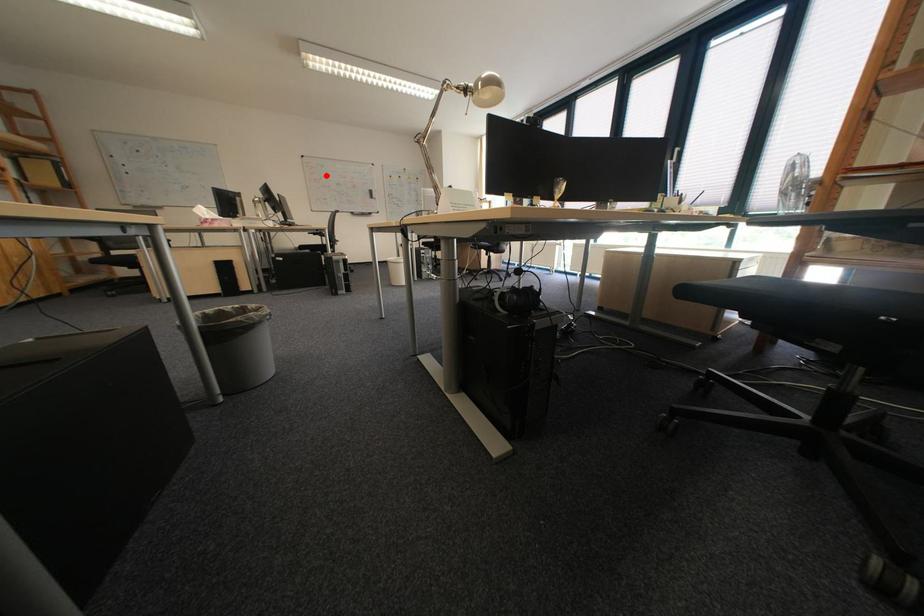
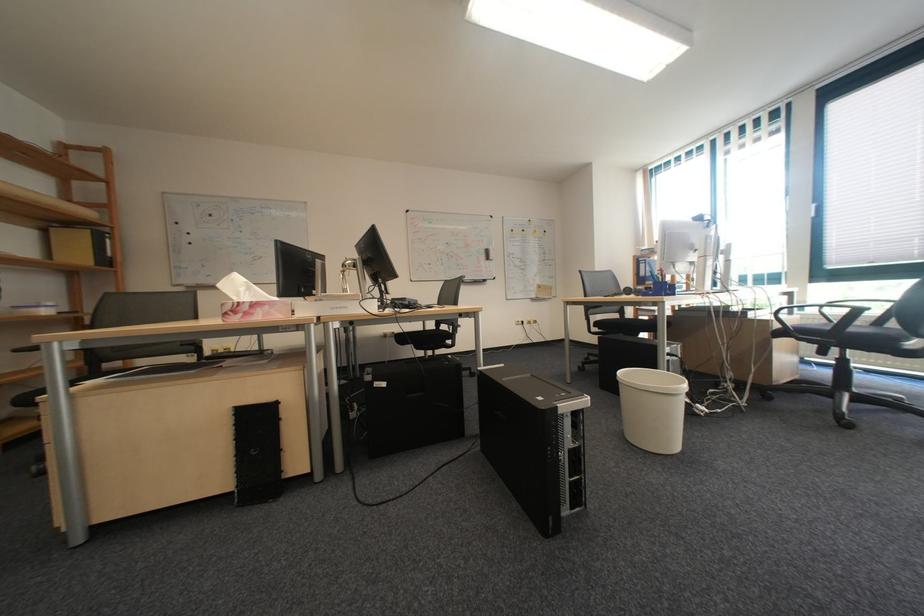
Locate, in the second image, the point that corresponds to the highlighted location in the first image.

(431, 233)